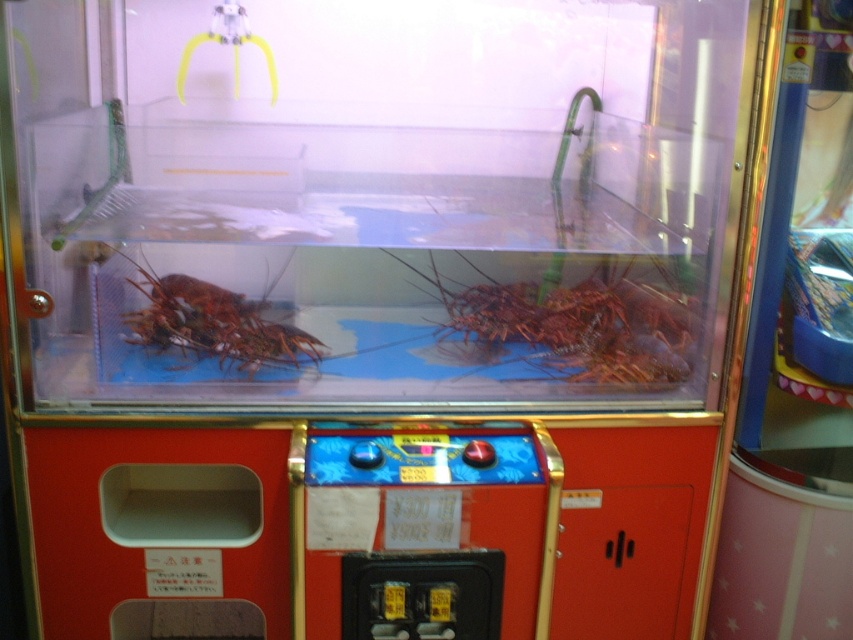
You are playing a claw machine game where you need to catch a lobster. The machine has two lobsters inside. Which lobster do you think is wider, the shiny red lobster at center or the red matte lobster at left?

The shiny red lobster at center is wider than the red matte lobster at left.

You are trying to catch a lobster using the claw machine. You see the shiny red lobster at center and the red matte lobster at left. Which lobster is closer to you?

The shiny red lobster at center is closer to you than the red matte lobster at left.